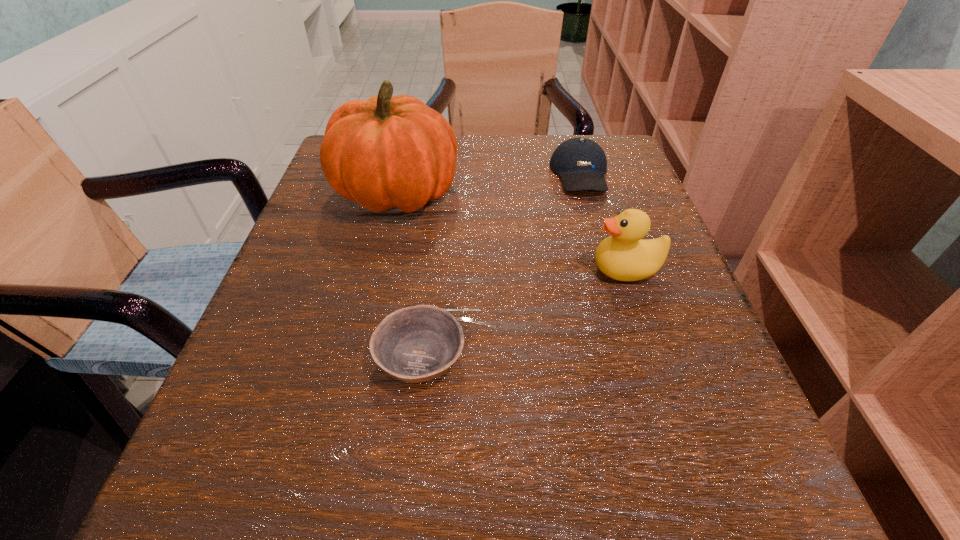
Where is `empty space that is in between the tallest object and the duck`? This screenshot has width=960, height=540. empty space that is in between the tallest object and the duck is located at coordinates (512, 231).

Where is `blank region between the duck and the pumpkin`? Image resolution: width=960 pixels, height=540 pixels. blank region between the duck and the pumpkin is located at coordinates point(512,231).

Identify the location of vacant area between the pumpkin and the nearest object. This screenshot has width=960, height=540. (408, 275).

Locate an element on the screen. The height and width of the screenshot is (540, 960). free point between the third shortest object and the nearest object is located at coordinates (523, 313).

The height and width of the screenshot is (540, 960). What are the coordinates of `free area in between the shortest object and the pumpkin` in the screenshot? It's located at (408, 275).

The width and height of the screenshot is (960, 540). I want to click on unoccupied position between the second shortest object and the third shortest object, so click(x=603, y=221).

Identify which object is the third nearest to the baseball cap. Please provide its 2D coordinates. Your answer should be formatted as a tuple, i.e. [(x, y)], where the tuple contains the x and y coordinates of a point satisfying the conditions above.

[(416, 344)]

Identify which object is the third nearest to the shortest object. Please provide its 2D coordinates. Your answer should be formatted as a tuple, i.e. [(x, y)], where the tuple contains the x and y coordinates of a point satisfying the conditions above.

[(581, 163)]